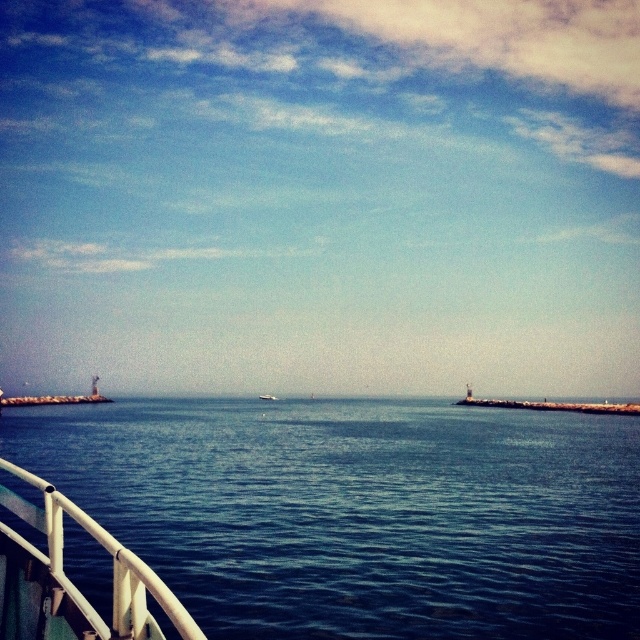
Question: Which point is closer to the camera?

Choices:
 (A) (288, 461)
 (B) (273, 401)
 (C) (118, 586)

Answer: (C)

Question: Which of these objects is positioned closest to the white plastic boat at center?

Choices:
 (A) white matte railing at lower left
 (B) blue water at lower left

Answer: (B)

Question: Can you confirm if blue water at lower left is positioned above white matte railing at lower left?

Choices:
 (A) no
 (B) yes

Answer: (A)

Question: From the image, what is the correct spatial relationship of white matte railing at lower left in relation to white plastic boat at center?

Choices:
 (A) right
 (B) left

Answer: (A)

Question: Estimate the real-world distances between objects in this image. Which object is farther from the white plastic boat at center?

Choices:
 (A) white matte railing at lower left
 (B) blue water at lower left

Answer: (A)

Question: Is white matte railing at lower left thinner than white plastic boat at center?

Choices:
 (A) yes
 (B) no

Answer: (A)